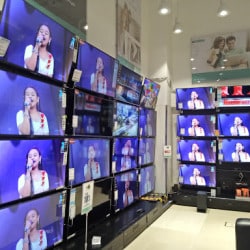
You are a GUI agent. You are given a task and a screenshot of the screen. Output one action in this format:
    pyautogui.click(x=<x>, y=<y>)
    Task: Click on the speaker
    This screenshot has width=250, height=250.
    Given the screenshot: What is the action you would take?
    pyautogui.click(x=201, y=200)